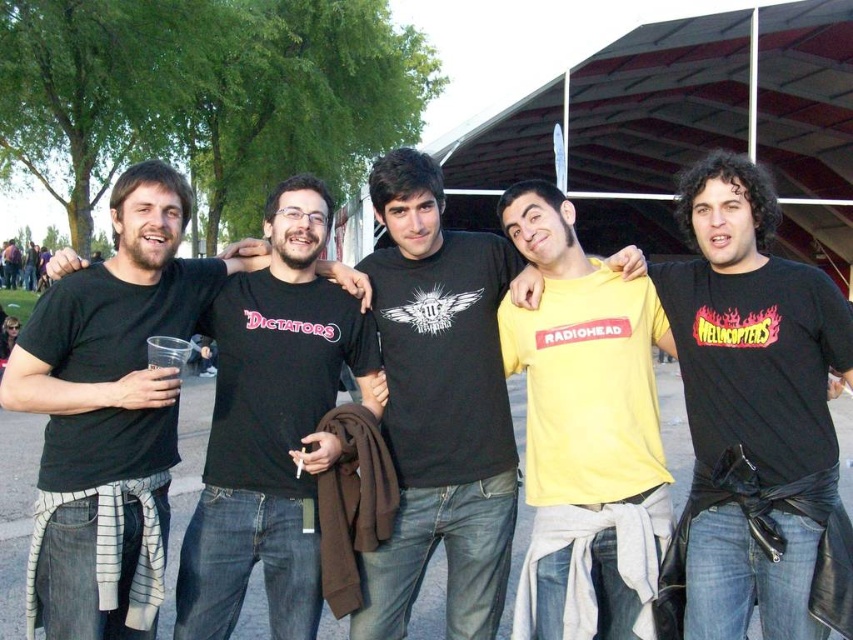
You are standing at the position of the person wearing the yellow matte shirt at center. You want to take a photo of the camera that is 5.33 meters away. Is the camera within the typical range of a smartphone camera lens? Explain your answer.

The camera is 5.33 meters away from the yellow matte shirt at center. Most smartphone cameras have a maximum focusing range that can handle distances up to several meters, but 5.33 meters may be beyond the effective range for clear photos without zoom. However, if the smartphone has optical zoom capabilities, it might still capture the camera clearly. Without zoom, the image may appear blurry or out of focus.